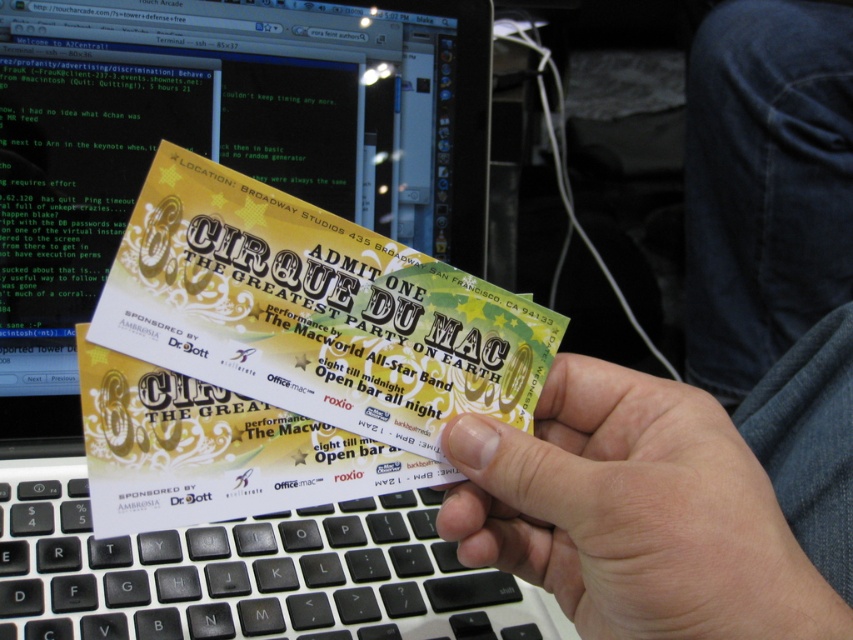
Is yellow paper ticket at center positioned before denim pants at lower right?

Yes.

Describe the element at coordinates (282, 355) in the screenshot. I see `yellow paper ticket at center` at that location.

Where is `yellow paper ticket at center`? yellow paper ticket at center is located at coordinates (282, 355).

Is black plastic keyboard at center to the right of denim pants at lower right from the viewer's perspective?

No, black plastic keyboard at center is not to the right of denim pants at lower right.

Does black plastic keyboard at center have a lesser width compared to denim pants at lower right?

No, black plastic keyboard at center is not thinner than denim pants at lower right.

Between point (462, 573) and point (843, 262), which one is positioned in front?

Positioned in front is point (462, 573).

What are the coordinates of `black plastic keyboard at center` in the screenshot? It's located at (247, 572).

Can you confirm if yellow paper ticket at center is positioned below smooth skin hand at center?

No, yellow paper ticket at center is not below smooth skin hand at center.

Which is more to the right, yellow paper ticket at center or smooth skin hand at center?

From the viewer's perspective, smooth skin hand at center appears more on the right side.

This screenshot has height=640, width=853. Identify the location of yellow paper ticket at center. pos(282,355).